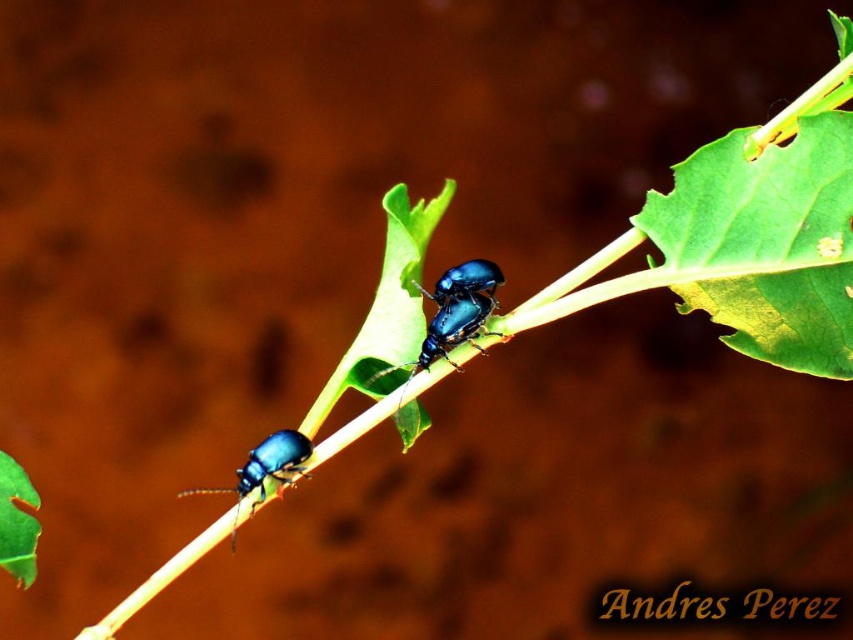
You are a photographer trying to capture a closeup of the metallic blue beetle at lower left. You are currently 1.5 meters away from the beetle. Can you move closer to get a better shot without exceeding the minimum safe distance of 1 meter? Please explain your reasoning.

The metallic blue beetle at lower left is currently 1.07 meters away from the camera. Since you are 1.5 meters away, you can move closer by 0.43 meters to reach the beetle at 1.07 meters, but you must not go beyond that to maintain the minimum safe distance of 1 meter. Therefore, you can move closer up to 1.07 meters, which is within the safe limit.

You are a tiny explorer on the plant stem and want to move from one point to the other. Which point, point (718, 216) or point (440, 276), is closer to you and easier to reach first?

Point (718, 216) is closer to the viewer than point (440, 276), so it is easier to reach first.

You are standing 1.04 meters away from the point at coordinates [786,282]. If you want to move closer to this point, which direction should you move?

The point at coordinates [786,282] is 1.04 meters away from you. To move closer, you should move forward towards the point.